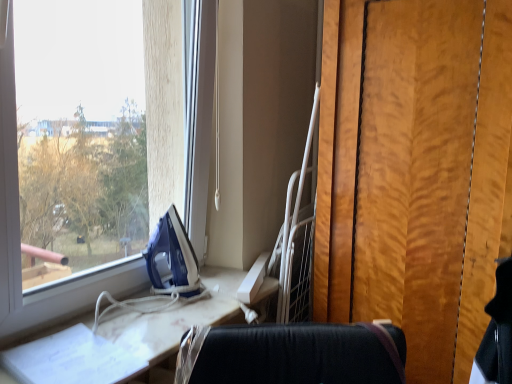
I want to click on free space in front of blue plastic iron at window, so point(160,317).